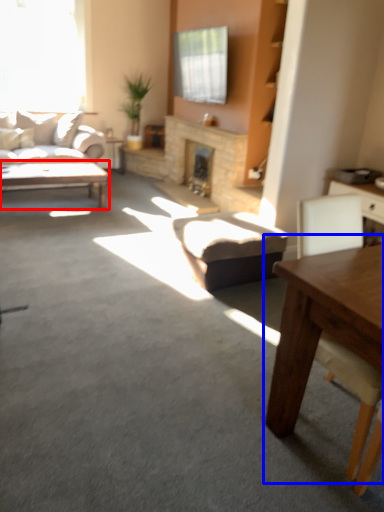
Question: Which object appears closest to the camera in this image, coffee table (highlighted by a red box) or table (highlighted by a blue box)?

Choices:
 (A) coffee table
 (B) table

Answer: (B)